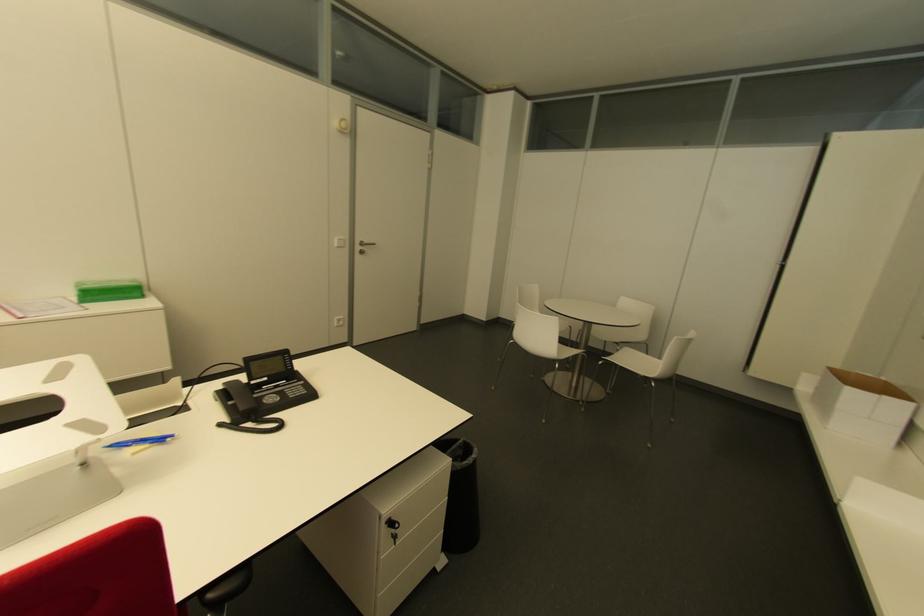
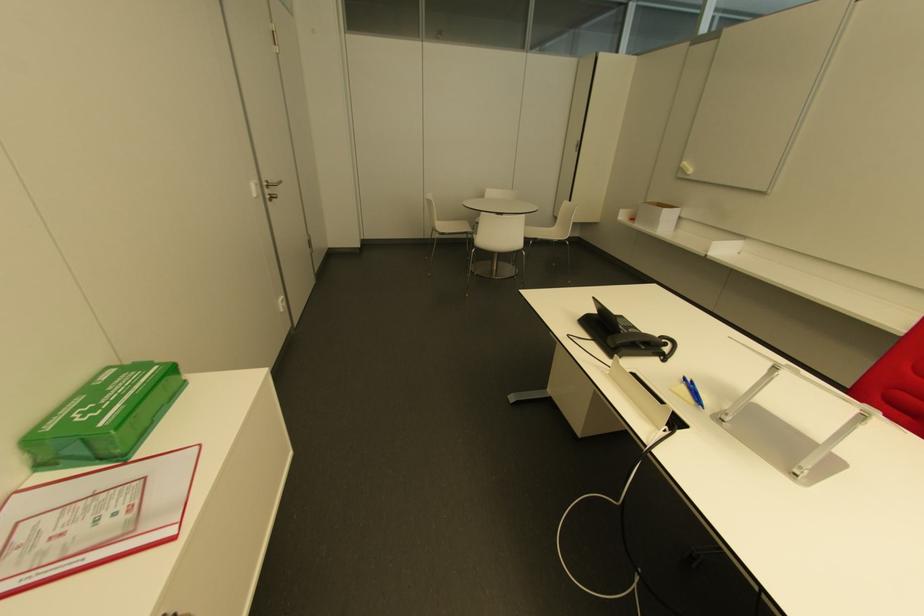
Locate, in the second image, the point that corresponds to point 651,379 in the first image.

(565, 240)